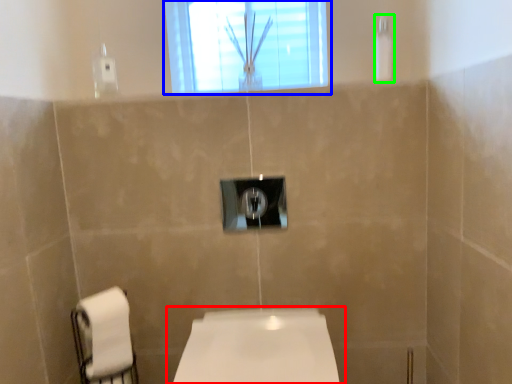
Question: Which object is the closest to the toilet (highlighted by a red box)? Choose among these: window (highlighted by a blue box) or shower (highlighted by a green box).

Choices:
 (A) window
 (B) shower

Answer: (B)